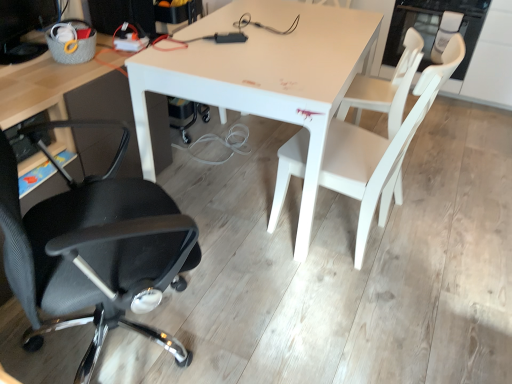
Where is `vacant space underneath white matte table at center (from a real-world perspective)`? This screenshot has width=512, height=384. vacant space underneath white matte table at center (from a real-world perspective) is located at coordinates (244, 165).